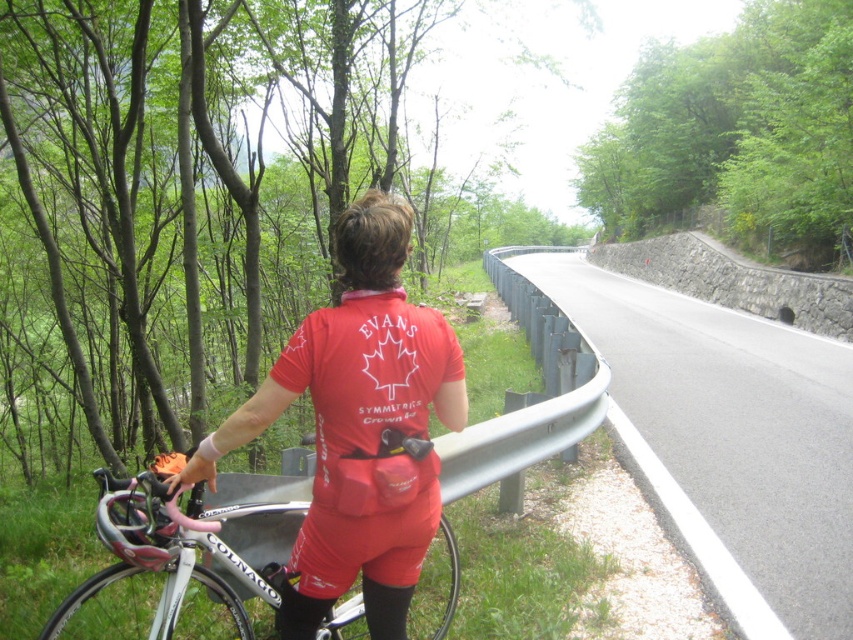
You are a delivery drone flying at an altitude of 10 feet. You need to land on the asphalt road at center to drop off a package. However, you must avoid the red matte cycling jersey at center, which is occupied by the cyclist. Is there enough space between the two objects for you to land safely?

The asphalt road at center is 20.64 feet from the red matte cycling jersey at center. Since the drone needs to land on the road and the jersey is 20.64 feet away, there is sufficient space between them for the drone to land safely on the asphalt road at center while avoiding the red matte cycling jersey at center.

You are a cyclist preparing to ride along the asphalt road at center. You notice a shiny black helmet at left. Based on the scene, which side of the helmet is the road located relative to it?

The asphalt road at center is to the right of the shiny black helmet at left.

You are a delivery person who needs to place both the white glossy bicycle at center and the shiny black helmet at left into a storage locker. The locker has a maximum width capacity of 24 inches. Can both items fit side by side without exceeding the locker width?

The white glossy bicycle at center and the shiny black helmet at left are 22.30 inches apart from each other. Since the total width required is 22.30 inches and the locker can hold up to 24 inches, both items can fit side by side within the locker.